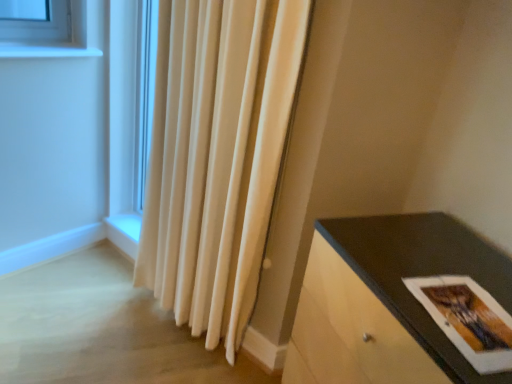
Locate an element on the screen. vacant space in matte paper postcard at lower right (from a real-world perspective) is located at coordinates (459, 312).